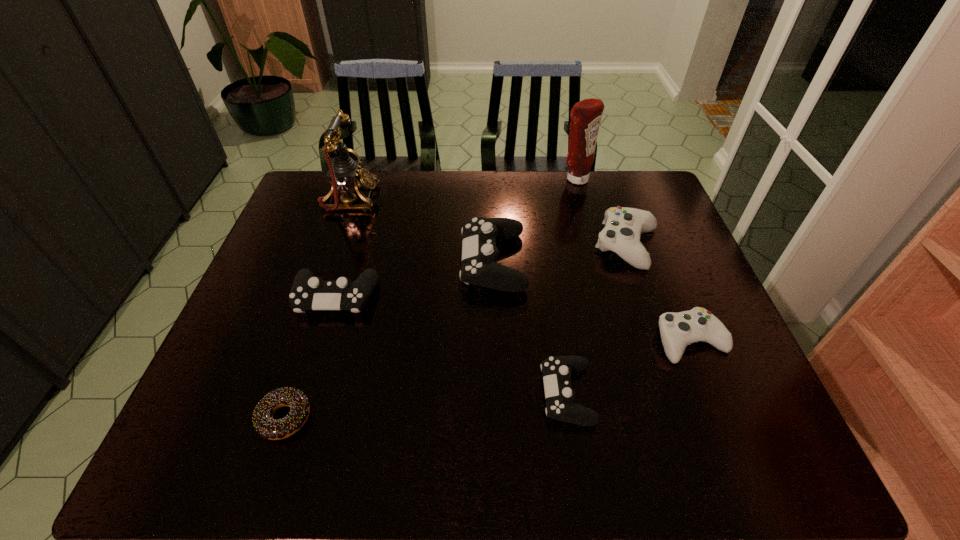
Where is `vacant region between the telephone and the biggest black control`? The image size is (960, 540). vacant region between the telephone and the biggest black control is located at coordinates (421, 230).

The image size is (960, 540). Identify the location of vacant space that's between the leftmost control and the condiment. (456, 238).

At what (x,y) coordinates should I click in order to perform the action: click on free point between the farther white control and the chocolate doughnut. Please return your answer as a coordinate pair (x, y). The image size is (960, 540). Looking at the image, I should click on pos(456,332).

The width and height of the screenshot is (960, 540). I want to click on vacant region between the fifth object from left to right and the leftmost black control, so click(451, 345).

The width and height of the screenshot is (960, 540). I want to click on vacant region between the telephone and the condiment, so click(x=463, y=189).

I want to click on vacant area between the nearest black control and the red condiment, so click(x=571, y=286).

The height and width of the screenshot is (540, 960). I want to click on free space between the rightmost black control and the black telephone, so click(x=459, y=296).

Identify which object is the third nearest to the farther white control. Please provide its 2D coordinates. Your answer should be formatted as a tuple, i.e. [(x, y)], where the tuple contains the x and y coordinates of a point satisfying the conditions above.

[(479, 267)]

I want to click on object that stands as the third closest to the leftmost black control, so click(345, 175).

Locate which control is the fourth closest to the black telephone. Please provide its 2D coordinates. Your answer should be formatted as a tuple, i.e. [(x, y)], where the tuple contains the x and y coordinates of a point satisfying the conditions above.

[(557, 370)]